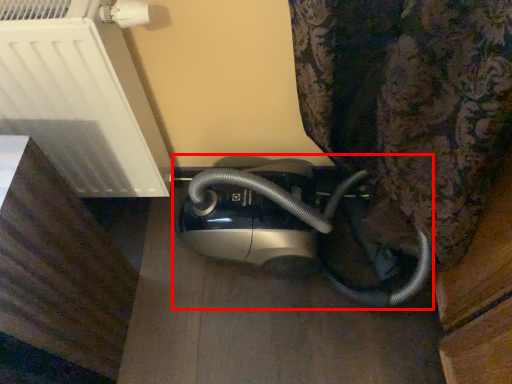
Question: Where is home appliance (annotated by the red box) located in relation to appliance in the image?

Choices:
 (A) left
 (B) right

Answer: (B)